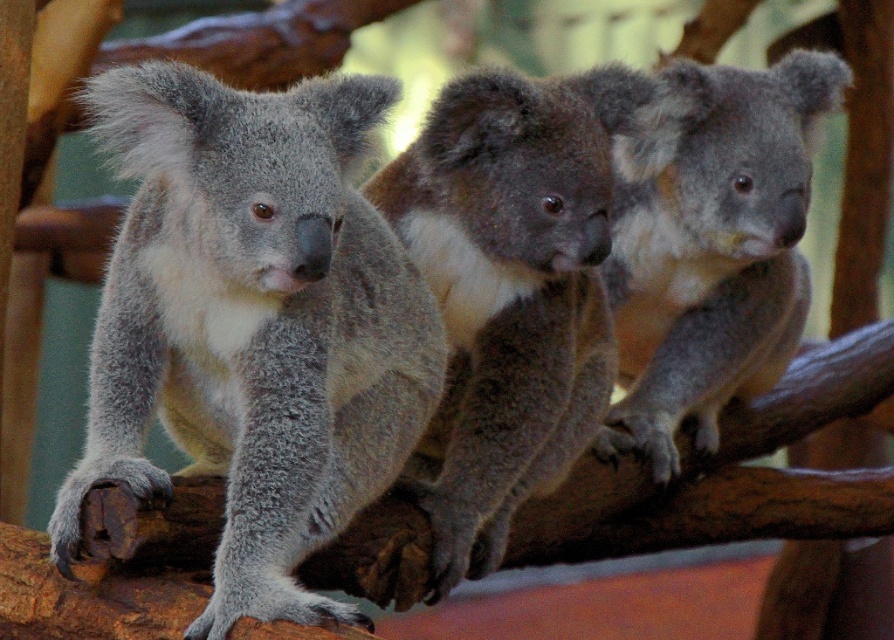
Question: Does gray fluffy koala at left lie in front of gray furry koala at center?

Choices:
 (A) no
 (B) yes

Answer: (B)

Question: Among these points, which one is farthest from the camera?

Choices:
 (A) (711, 83)
 (B) (519, 440)

Answer: (A)

Question: Which object is the closest to the gray furry koala at center?

Choices:
 (A) gray fluffy koala at left
 (B) fuzzy gray koala at center

Answer: (B)

Question: Which point is closer to the camera?

Choices:
 (A) (780, 280)
 (B) (627, 72)
 (C) (240, 540)

Answer: (C)

Question: Is fuzzy gray koala at center positioned in front of gray furry koala at center?

Choices:
 (A) yes
 (B) no

Answer: (A)

Question: Can you confirm if gray fluffy koala at left is wider than gray furry koala at center?

Choices:
 (A) no
 (B) yes

Answer: (B)